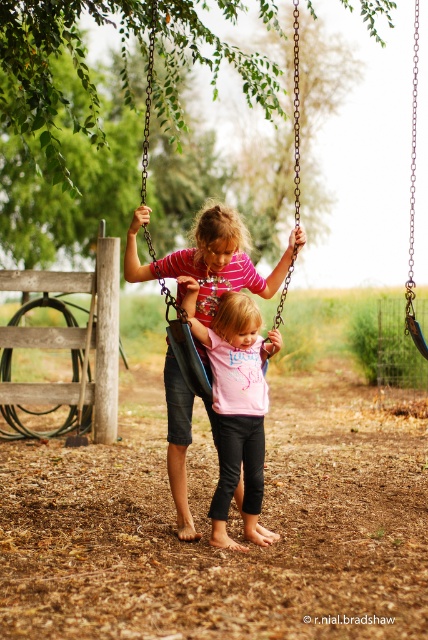
Question: Which point is farther from the camera taking this photo?

Choices:
 (A) (297, 48)
 (B) (240, 346)
 (C) (243, 228)

Answer: (A)

Question: Is matte pink shirt at center positioned in front of pink matte shirt at center?

Choices:
 (A) no
 (B) yes

Answer: (B)

Question: Among these points, which one is nearest to the camera?

Choices:
 (A) (193, 380)
 (B) (237, 465)

Answer: (A)

Question: Which is nearer to the black plastic swing at center?

Choices:
 (A) matte pink shirt at center
 (B) pink matte shirt at center

Answer: (B)

Question: In this image, where is matte pink shirt at center located relative to black plastic swing at center?

Choices:
 (A) above
 (B) below

Answer: (B)

Question: Can you confirm if pink matte shirt at center is positioned to the left of black plastic swing at center?

Choices:
 (A) yes
 (B) no

Answer: (B)